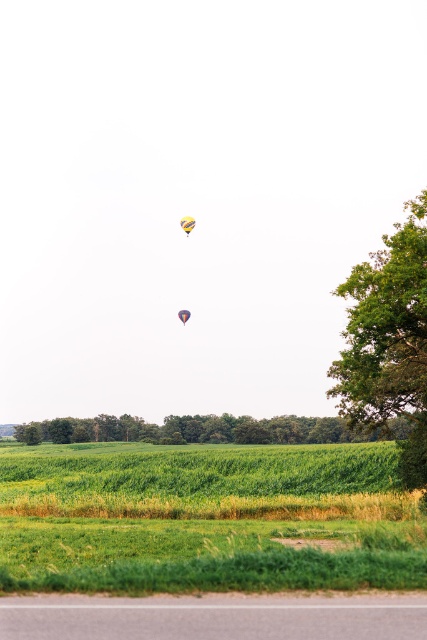
Is point (388, 243) positioned behind point (181, 308)?

No, (388, 243) is closer to viewer.

Is green leafy tree at right bigger than multicolored fabric balloon at upper center?

Yes, green leafy tree at right is bigger than multicolored fabric balloon at upper center.

Is point (412, 284) closer to camera compared to point (187, 321)?

Yes, point (412, 284) is in front of point (187, 321).

Locate an element on the screen. The height and width of the screenshot is (640, 427). green leafy tree at right is located at coordinates (388, 340).

Does point (356, 556) come in front of point (275, 433)?

Yes, it is in front of point (275, 433).

The image size is (427, 640). Describe the element at coordinates (207, 518) in the screenshot. I see `green grassy field at lower center` at that location.

This screenshot has width=427, height=640. What do you see at coordinates (207, 518) in the screenshot?
I see `green grassy field at lower center` at bounding box center [207, 518].

This screenshot has width=427, height=640. Find the location of `green grassy field at lower center`. green grassy field at lower center is located at coordinates (207, 518).

Does green leafy tree at right have a greater width compared to green leafy tree at center?

→ In fact, green leafy tree at right might be narrower than green leafy tree at center.

Between green leafy tree at right and green leafy tree at center, which one is positioned higher?

green leafy tree at right is higher up.

Who is more distant from viewer, (362, 328) or (56, 428)?

The point (56, 428) is more distant.

I want to click on green leafy tree at right, so click(x=388, y=340).